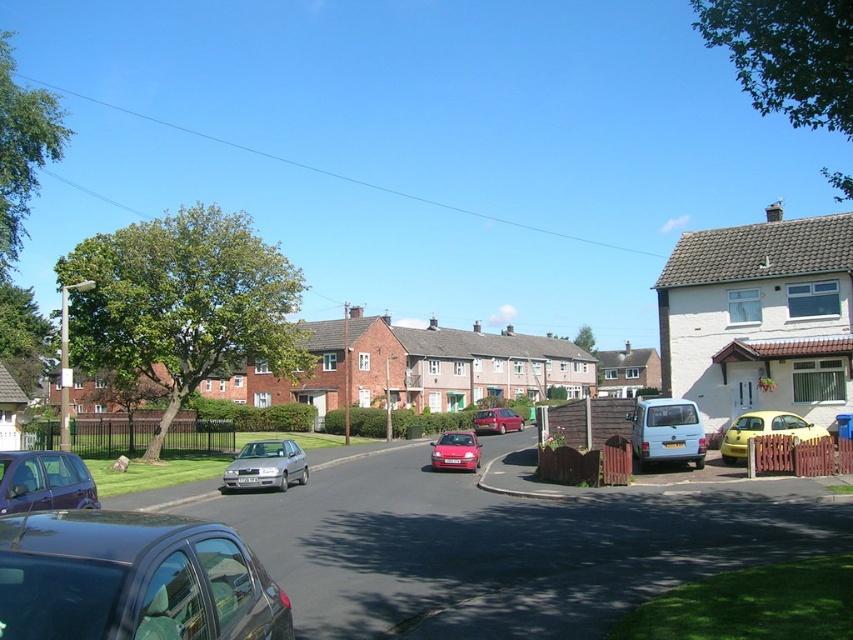
Between metallic blue hatchback at lower left and shiny red car at center, which one appears on the left side from the viewer's perspective?

From the viewer's perspective, metallic blue hatchback at lower left appears more on the left side.

Which is below, metallic blue hatchback at lower left or shiny red car at center?

Positioned lower is shiny red car at center.

Between point (68, 490) and point (437, 458), which one is positioned in front?

Point (68, 490) is more forward.

Find the location of a particular element. The width and height of the screenshot is (853, 640). metallic blue hatchback at lower left is located at coordinates [x=44, y=481].

Who is positioned more to the right, shiny black car at lower left or light blue matte van at center-right?

light blue matte van at center-right is more to the right.

Which of these two, shiny black car at lower left or light blue matte van at center-right, stands taller?

With more height is light blue matte van at center-right.

The width and height of the screenshot is (853, 640). Describe the element at coordinates (132, 579) in the screenshot. I see `shiny black car at lower left` at that location.

This screenshot has width=853, height=640. I want to click on shiny black car at lower left, so click(132, 579).

Which is behind, point (91, 493) or point (752, 419)?

Point (752, 419)

Can you confirm if metallic blue hatchback at lower left is positioned to the right of yellow matte car at right?

Incorrect, metallic blue hatchback at lower left is not on the right side of yellow matte car at right.

Describe the element at coordinates (44, 481) in the screenshot. The height and width of the screenshot is (640, 853). I see `metallic blue hatchback at lower left` at that location.

Where is `metallic blue hatchback at lower left`? The image size is (853, 640). metallic blue hatchback at lower left is located at coordinates (44, 481).